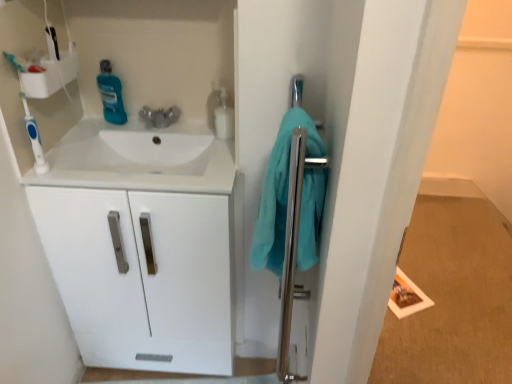
You are a GUI agent. You are given a task and a screenshot of the screen. Output one action in this format:
    pyautogui.click(x=<x>, y=<y>)
    Task: Click on the vacant space behind blue plastic toothbrush at left
    The image size is (512, 384).
    Given the screenshot: What is the action you would take?
    pyautogui.click(x=64, y=152)